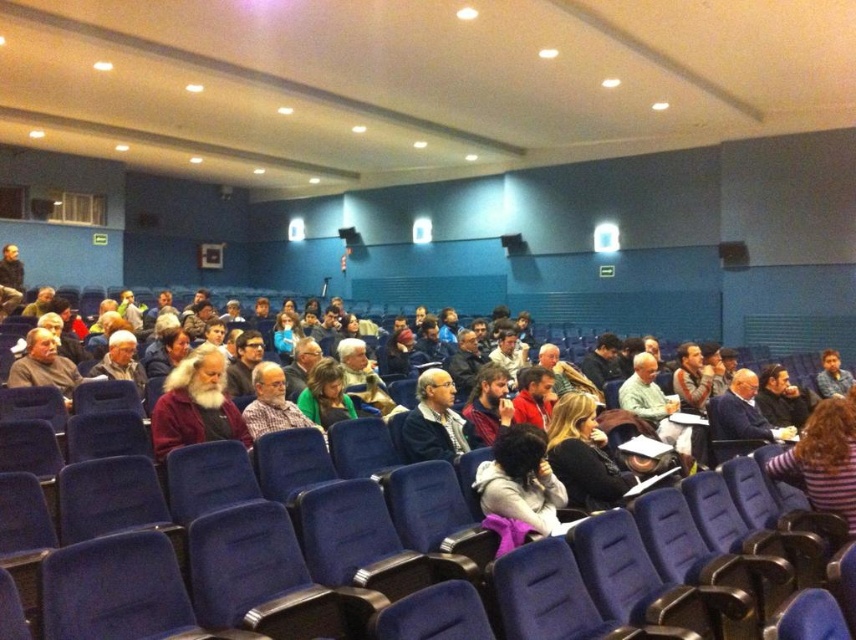
Question: Which of the following is the farthest from the observer?

Choices:
 (A) light brown hair at center
 (B) bearded man at center
 (C) gray wool sweater at center
 (D) purple wool sweater at center

Answer: (A)

Question: Does dark purple sweater at center lie in front of light brown hair at center?

Choices:
 (A) yes
 (B) no

Answer: (A)

Question: Estimate the real-world distances between objects in this image. Which object is closer to the dark purple sweater at center?

Choices:
 (A) gray wool sweater at center
 (B) light brown hair at center

Answer: (A)

Question: Does gray wool sweater at center have a smaller size compared to light brown hair at center?

Choices:
 (A) yes
 (B) no

Answer: (A)

Question: Which object is closer to the camera taking this photo?

Choices:
 (A) gray wool sweater at center
 (B) purple wool sweater at center
 (C) light brown hair at center
 (D) bearded man at center

Answer: (B)

Question: Can you confirm if purple wool sweater at center is thinner than bearded man at center?

Choices:
 (A) no
 (B) yes

Answer: (A)